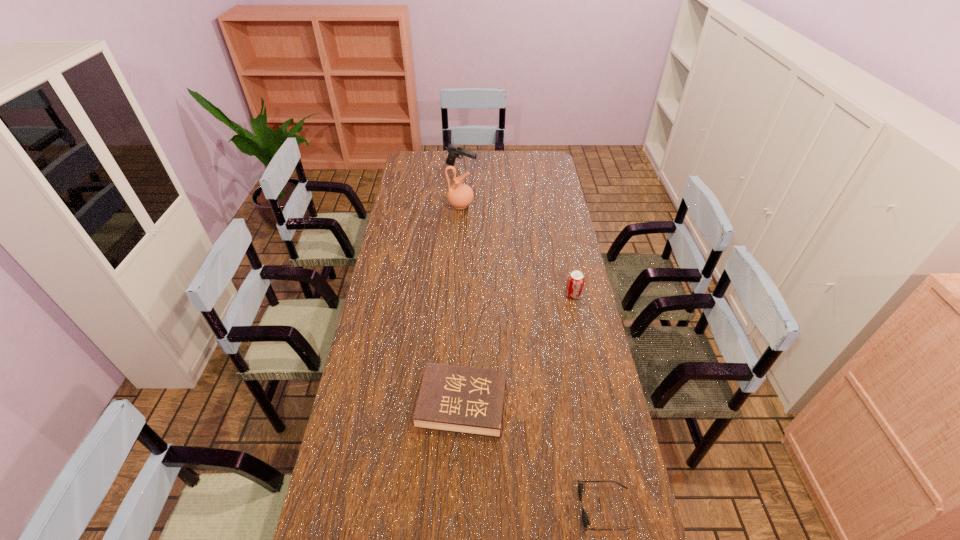
Where is `vacant space that satisfies the following two spatial constraints: 1. at the muzzle of the second shortest object; 2. on the left side of the gun`? This screenshot has width=960, height=540. vacant space that satisfies the following two spatial constraints: 1. at the muzzle of the second shortest object; 2. on the left side of the gun is located at coordinates tap(447, 404).

Image resolution: width=960 pixels, height=540 pixels. In order to click on free space that satisfies the following two spatial constraints: 1. on the spout of the second farthest object; 2. on the right side of the third farthest object in this screenshot , I will do `click(455, 295)`.

Identify the location of vacant area in the image that satisfies the following two spatial constraints: 1. on the spout of the pottery; 2. on the right side of the second shortest object. (449, 404).